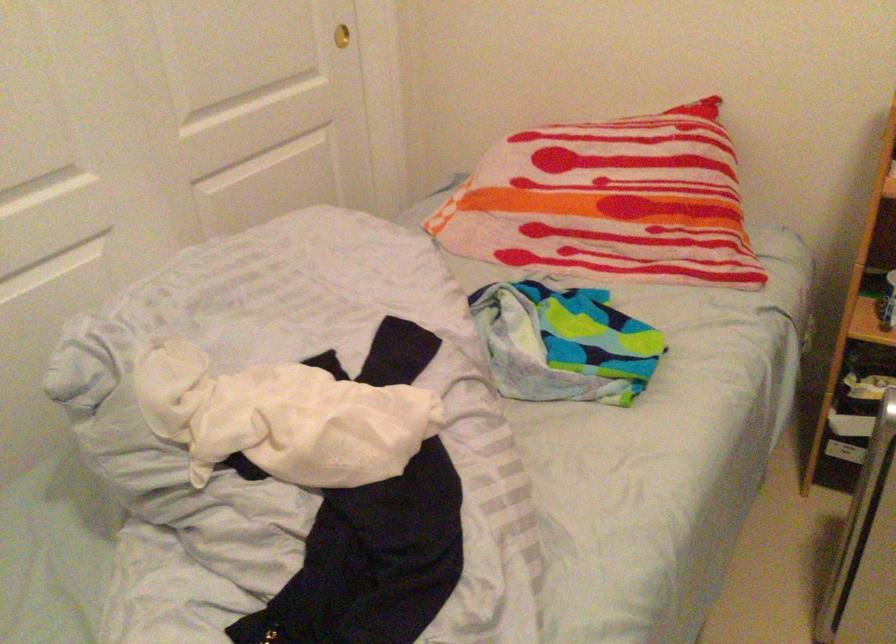
Where is `gold door handle`? gold door handle is located at coordinates (340, 35).